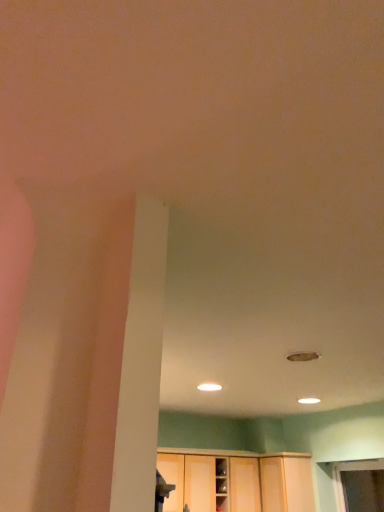
What do you see at coordinates (237, 482) in the screenshot? I see `light wood cabinet at lower center` at bounding box center [237, 482].

Locate an element on the screen. light wood cabinet at lower center is located at coordinates (237, 482).

The height and width of the screenshot is (512, 384). Find the location of `light wood cabinet at lower center`. light wood cabinet at lower center is located at coordinates (237, 482).